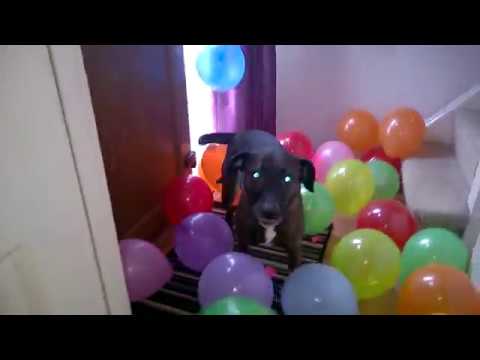
You are a GUI agent. You are given a task and a screenshot of the screen. Output one action in this format:
    pyautogui.click(x=<x>, y=<y>)
    Task: Click on the purple curtain
    
    Given the screenshot: What is the action you would take?
    pyautogui.click(x=260, y=104)